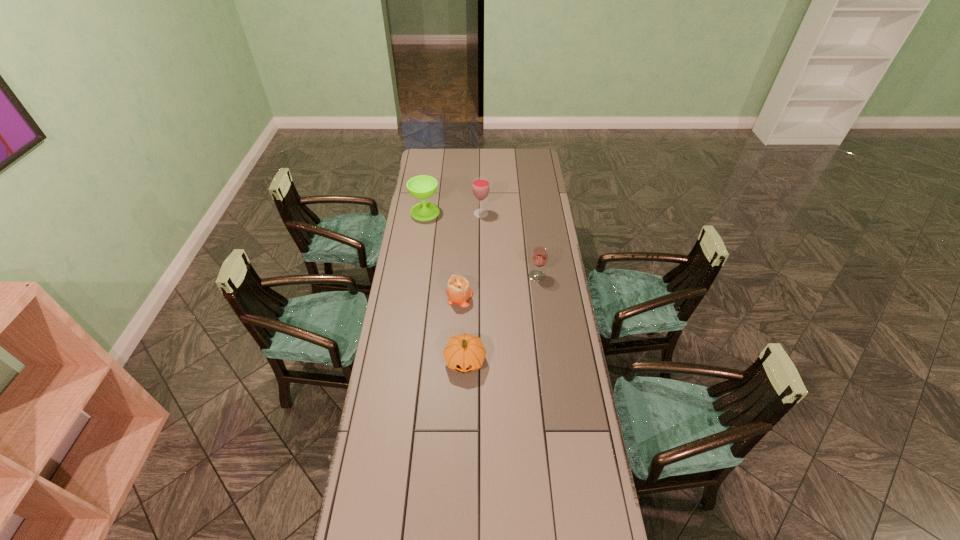
Where is `vacant space situated 0.050m on the side of the gourd with the carved face`? This screenshot has width=960, height=540. vacant space situated 0.050m on the side of the gourd with the carved face is located at coordinates (465, 392).

Find the location of a particular element. The width and height of the screenshot is (960, 540). object at the left edge is located at coordinates (422, 187).

Image resolution: width=960 pixels, height=540 pixels. I want to click on object that is at the right edge, so click(539, 257).

In the image, there is a desktop. What are the coordinates of `blank space at the far edge` in the screenshot? It's located at (508, 154).

I want to click on free region at the left edge of the desktop, so (x=384, y=347).

Find the location of a particular element. The image size is (960, 540). blank area at the right edge is located at coordinates (530, 231).

The height and width of the screenshot is (540, 960). What are the coordinates of `vacant space at the far left corner of the desktop` in the screenshot? It's located at (437, 151).

Locate an element on the screen. vacant space at the far right corner of the desktop is located at coordinates (538, 158).

This screenshot has width=960, height=540. What are the coordinates of `empty space between the nearest object and the leftmost object` in the screenshot? It's located at (x=445, y=286).

What are the coordinates of `free spot between the leftmost object and the rightmost wineglass` in the screenshot? It's located at (481, 244).